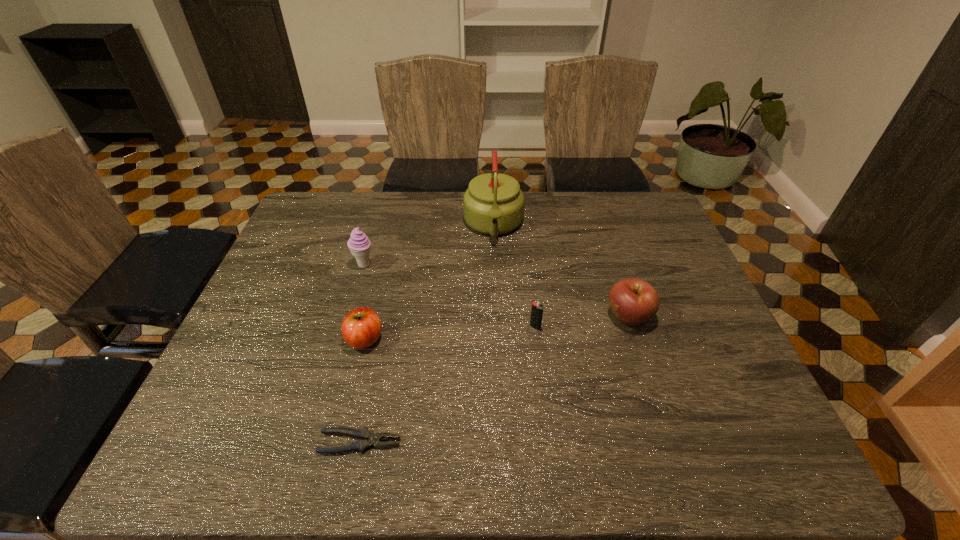
Image resolution: width=960 pixels, height=540 pixels. I want to click on vacant area located on the left of the second tallest object, so click(299, 265).

The height and width of the screenshot is (540, 960). In order to click on free space located on the side of the right apple with the unique marking in this screenshot , I will do `click(469, 317)`.

I want to click on vacant space located 0.380m on the side of the right apple with the unique marking, so click(458, 317).

This screenshot has height=540, width=960. In order to click on free space located on the side of the right apple with the unique marking in this screenshot , I will do `click(578, 317)`.

Image resolution: width=960 pixels, height=540 pixels. In order to click on free spot located 0.150m on the back of the left apple in this screenshot , I will do `click(378, 284)`.

Locate an element on the screen. vacant space positioned 0.280m on the front of the igniter is located at coordinates (548, 436).

Identify the location of free region located 0.270m at the gripping part of the nearest object. (534, 442).

Identify the location of object located at the far edge. (493, 204).

What are the coordinates of `object that is at the near edge` in the screenshot? It's located at [368, 439].

Where is `object located at the right edge`? This screenshot has height=540, width=960. object located at the right edge is located at coordinates (633, 301).